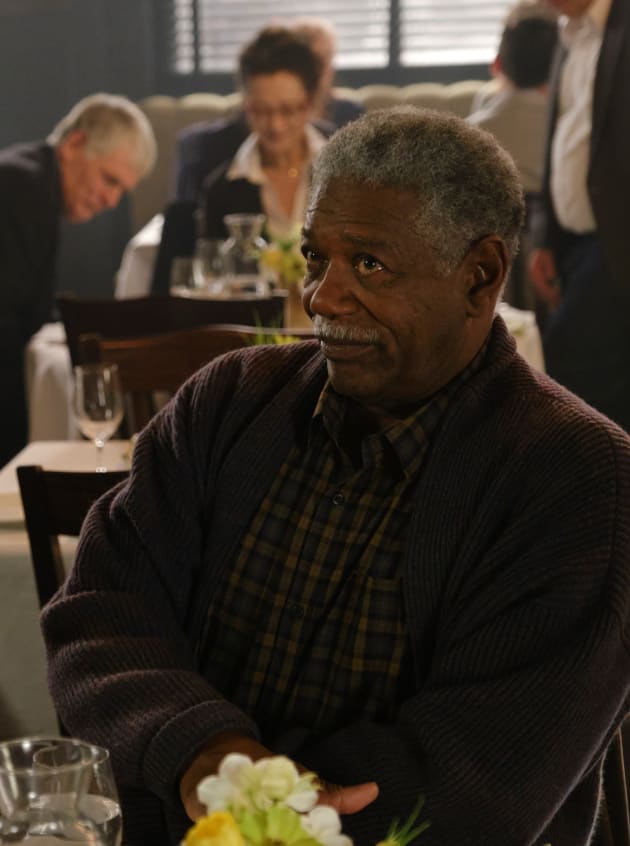
I want to click on light gray wall, so click(x=49, y=66).